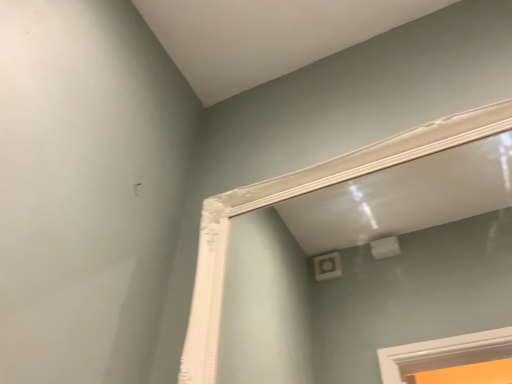
This screenshot has height=384, width=512. What do you see at coordinates (300, 194) in the screenshot? I see `white glossy window frame at upper center` at bounding box center [300, 194].

The image size is (512, 384). Find the location of `white glossy window frame at upper center`. white glossy window frame at upper center is located at coordinates (300, 194).

Image resolution: width=512 pixels, height=384 pixels. In order to click on white glossy window frame at upper center in this screenshot , I will do `click(300, 194)`.